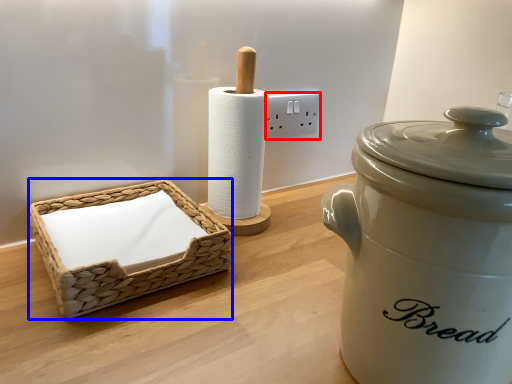
Question: Which point is closer to the camera, electric outlet (highlighted by a red box) or basket (highlighted by a blue box)?

Choices:
 (A) electric outlet
 (B) basket

Answer: (B)